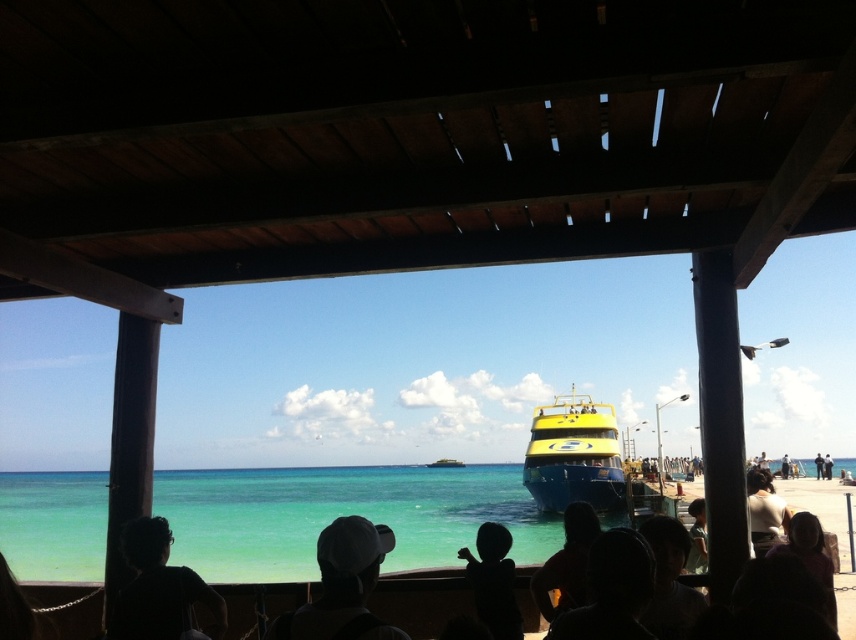
Between point (302, 624) and point (221, 625), which one is positioned in front?

Point (302, 624) is in front.

Which is behind, point (363, 612) or point (220, 628)?

The point (220, 628) is more distant.

I want to click on white fabric cap at center, so click(x=342, y=586).

Is black matte head at lower left to the left of black fabric headscarf at lower center from the viewer's perspective?

Indeed, black matte head at lower left is positioned on the left side of black fabric headscarf at lower center.

Locate an element on the screen. black matte head at lower left is located at coordinates (159, 589).

This screenshot has width=856, height=640. What do you see at coordinates (159, 589) in the screenshot?
I see `black matte head at lower left` at bounding box center [159, 589].

This screenshot has height=640, width=856. Find the location of `black matte head at lower left`. black matte head at lower left is located at coordinates (159, 589).

Who is positioned more to the right, clear blue water at lower center or yellow matte boat at center?

yellow matte boat at center is more to the right.

The image size is (856, 640). What are the coordinates of `clear blue water at lower center` in the screenshot? It's located at (342, 515).